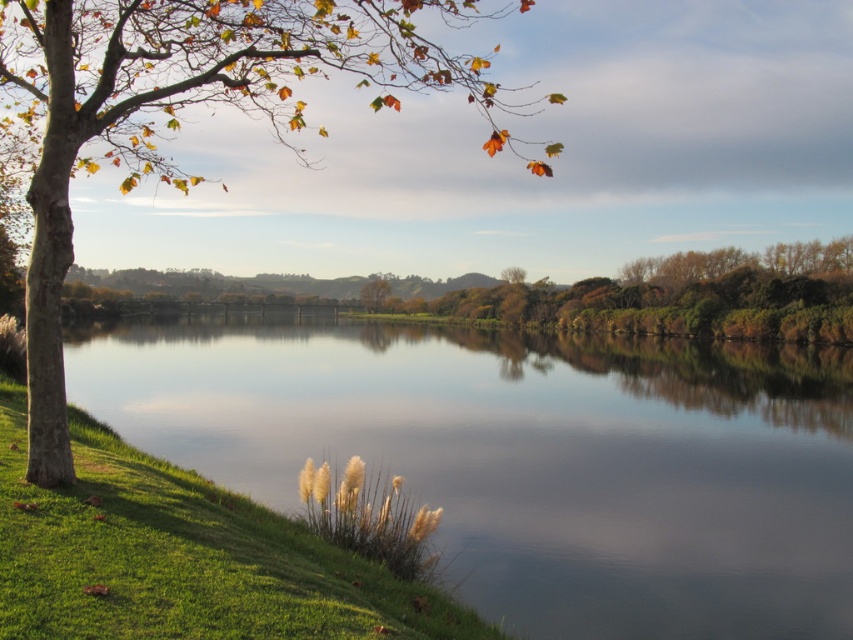
Can you confirm if brown rough bark tree at upper left is shorter than green leafy trees at center?

No, brown rough bark tree at upper left is not shorter than green leafy trees at center.

From the picture: Is brown rough bark tree at upper left smaller than green leafy trees at center?

Incorrect, brown rough bark tree at upper left is not smaller in size than green leafy trees at center.

The width and height of the screenshot is (853, 640). I want to click on brown rough bark tree at upper left, so click(x=178, y=115).

Which of these two, green grassy bank at lower left or green leafy tree at center, stands taller?

Standing taller between the two is green leafy tree at center.

Is green grassy bank at lower left taller than green leafy tree at center?

In fact, green grassy bank at lower left may be shorter than green leafy tree at center.

The height and width of the screenshot is (640, 853). Identify the location of green grassy bank at lower left. (526, 458).

Which is more to the right, green grassy bank at lower left or green leafy trees at center?

green leafy trees at center

Between green grassy bank at lower left and green leafy trees at center, which one has less height?

green grassy bank at lower left is shorter.

Is point (450, 429) less distant than point (752, 307)?

Yes, point (450, 429) is in front of point (752, 307).

Find the location of a particular element. This screenshot has height=640, width=853. green grassy bank at lower left is located at coordinates (526, 458).